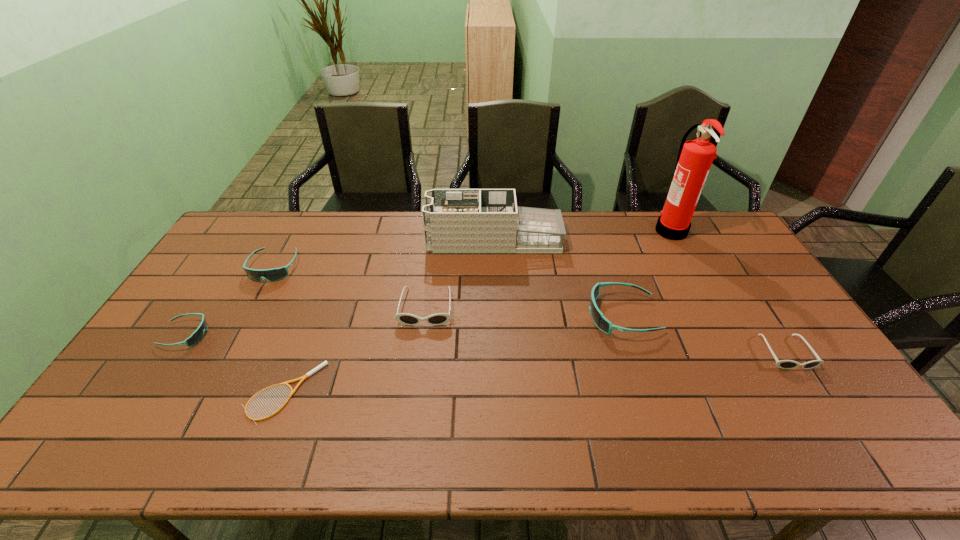
The width and height of the screenshot is (960, 540). I want to click on vacant space located 0.220m at the entrance of the dollhouse, so click(367, 240).

I want to click on free space located 0.380m on the front-facing side of the sixth object from left to right, so click(462, 316).

At what (x,y) coordinates should I click in order to perform the action: click on free point located 0.240m on the front-facing side of the sixth object from left to right. Please return your answer as a coordinate pair (x, y). Looking at the image, I should click on (508, 316).

Where is `vacant position located on the front-facing side of the sixth object from left to right`? vacant position located on the front-facing side of the sixth object from left to right is located at coordinates pyautogui.click(x=541, y=316).

Locate an element on the screen. Image resolution: width=960 pixels, height=540 pixels. free region located 0.360m on the front-facing side of the farthest sunglasses is located at coordinates tap(216, 376).

Locate an element on the screen. free space located 0.070m with the lenses of the left black sunglasses facing outward is located at coordinates (421, 346).

This screenshot has width=960, height=540. I want to click on blank area located 0.140m on the front-facing side of the leftmost object, so click(x=256, y=335).

Identify the location of blank space located 0.070m with the lenses of the nearer black sunglasses facing outward. The height and width of the screenshot is (540, 960). (812, 394).

Locate an element on the screen. free space located on the right of the third object from left to right is located at coordinates (374, 393).

Where is `fire extinguisher that is at the far edge`? The height and width of the screenshot is (540, 960). fire extinguisher that is at the far edge is located at coordinates (695, 157).